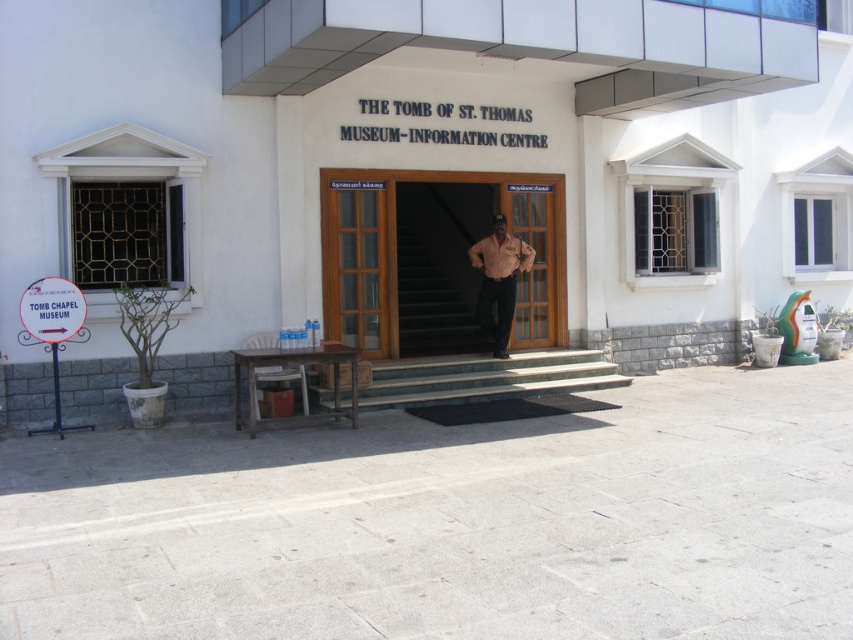
You are a visitor approaching the entrance of the museum. You see the brown wooden door at center and the matte beige shirt at center. Which object is closer to the left side of the entrance?

The brown wooden door at center is to the left of the matte beige shirt at center, so the brown wooden door at center is closer to the left side of the entrance.

You are standing at the entrance of the museum and want to take a photo of the brown wooden door at center. If your camera can focus on objects up to 50 feet away, will it be able to capture the door clearly?

The brown wooden door at center is 45.70 feet away from the camera. Since the camera can focus up to 50 feet, it can capture the door clearly as the distance is within range.